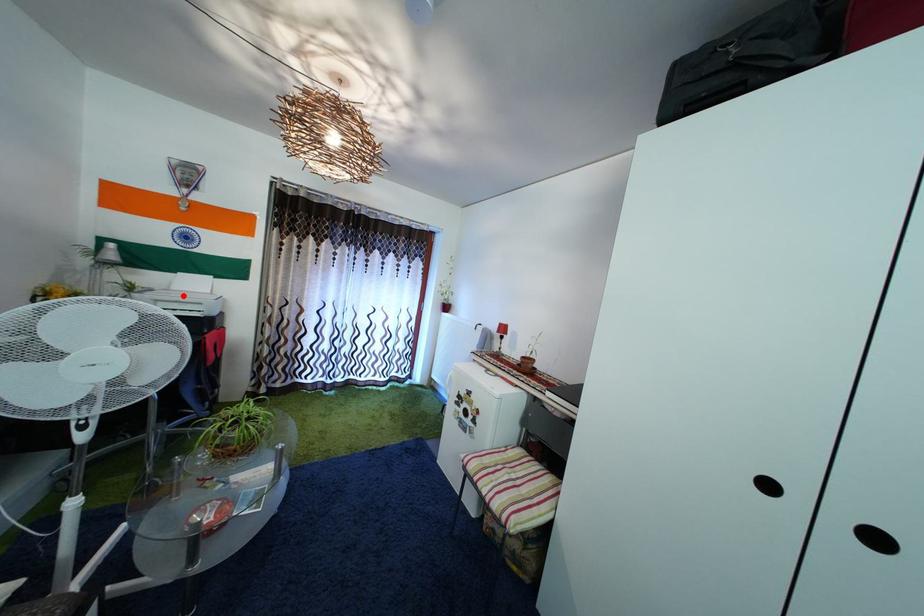
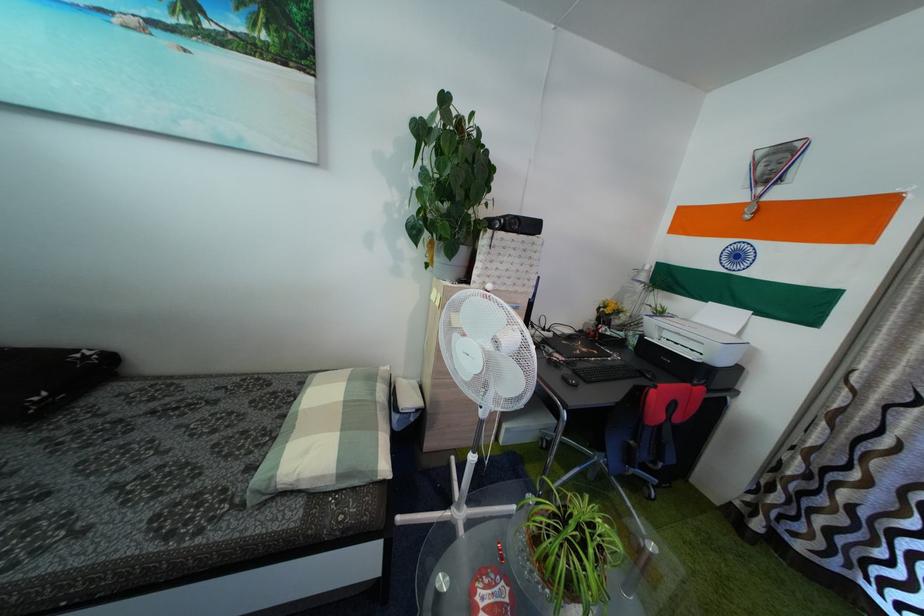
Find the pixel in the second image that matches the highlighted location in the first image.

(703, 328)